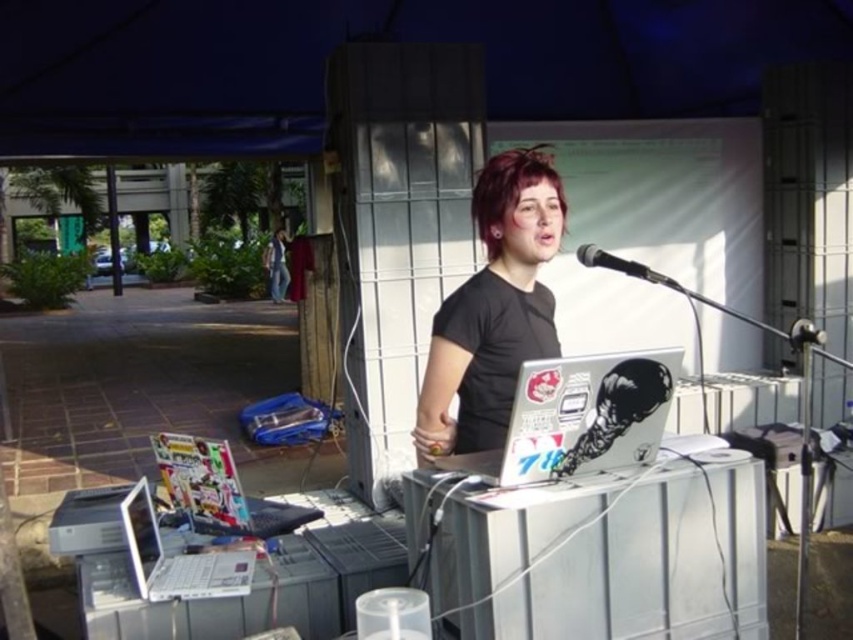
You are setting up for a live event and need to adjust the microphones. Which microphone is positioned higher up between the black metallic microphone at upper right and the metallic silver microphone at right?

The black metallic microphone at upper right is positioned higher up than the metallic silver microphone at right.

Looking at this image, you are a photographer setting up for a live event. You need to position your camera so that both the point at coordinates point (608, 260) and the point at coordinates point (801, 324) are in focus. Which point should you focus on first to ensure both are sharp?

You should focus on point (608, 260) first because it is closer to the camera than point (801, 324). By focusing on the closer point, the farther point will also be within the depth of field range, ensuring both are sharp.